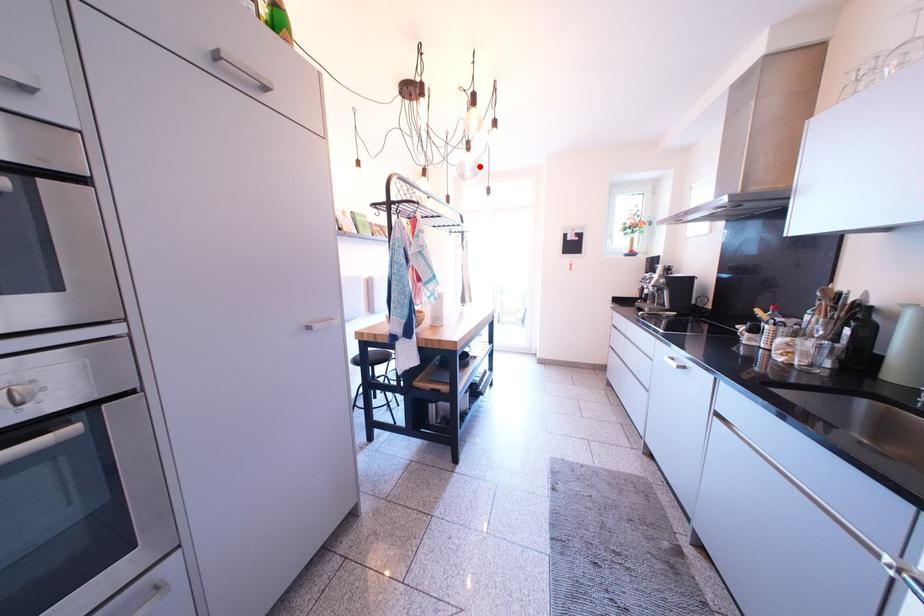
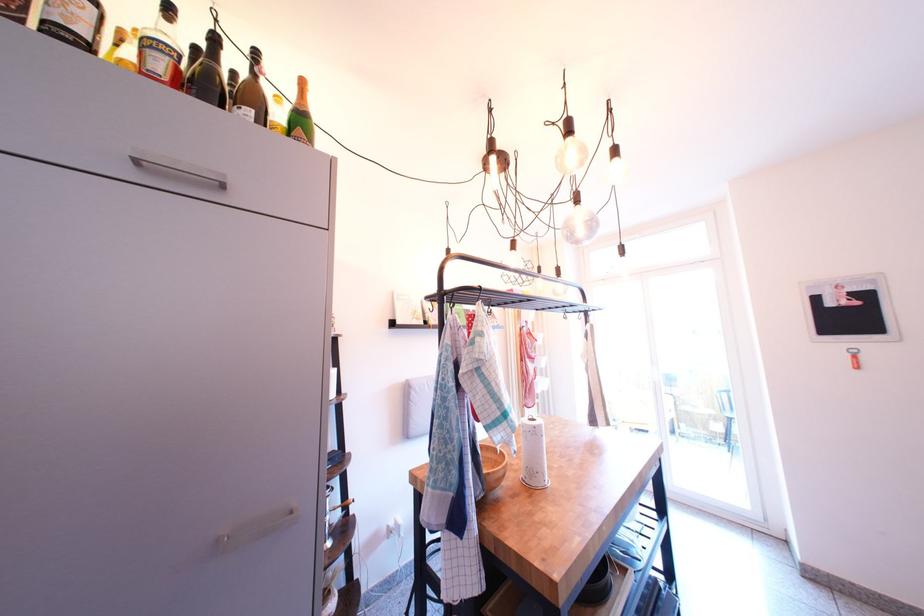
Question: I am providing you with two images of the same scene from different viewpoints. In image1, a red point is highlighted. Considering the same 3D point in image2, which of the following is correct?

Choices:
 (A) It is closer
 (B) It is farther

Answer: (A)